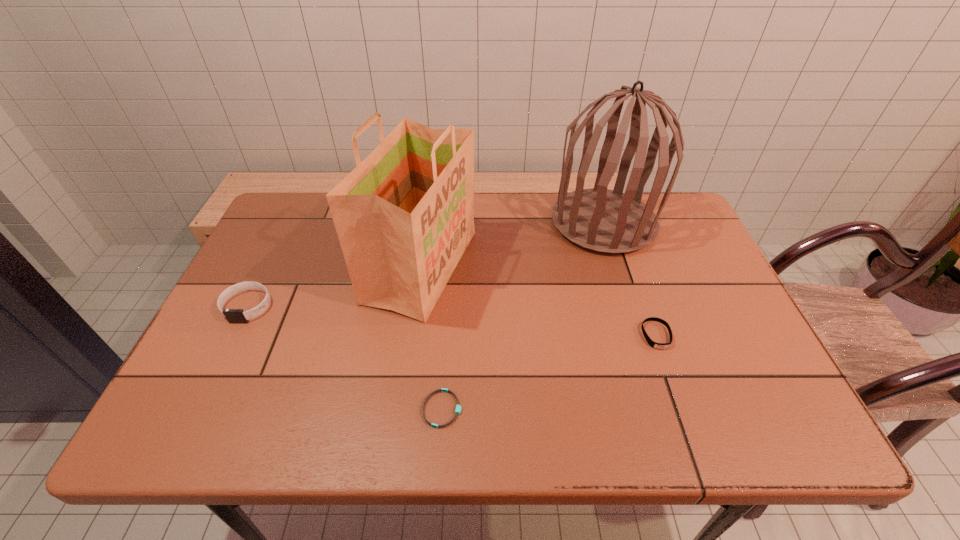
The image size is (960, 540). I want to click on free space between the leftmost object and the nearest wristband, so click(345, 357).

I want to click on vacant space that is in between the grocery bag and the shortest wristband, so click(x=432, y=338).

Where is `free space between the second shortest object and the third shortest object`? The width and height of the screenshot is (960, 540). free space between the second shortest object and the third shortest object is located at coordinates (452, 321).

Locate an element on the screen. This screenshot has width=960, height=540. object that stands as the fourth closest to the third shortest object is located at coordinates (653, 344).

Locate an element on the screen. The image size is (960, 540). object that is the closest to the rightmost wristband is located at coordinates tap(608, 221).

Identify the location of wristband that is the closest to the rightmost wristband. (458, 407).

At what (x,y) coordinates should I click in order to perform the action: click on wristband that is the closest one to the nearest wristband. Please return your answer as a coordinate pair (x, y). The image size is (960, 540). Looking at the image, I should click on (653, 344).

Identify the location of vacant space that satisfies the following two spatial constraints: 1. on the back side of the birdcage; 2. on the right side of the grocery bag. (427, 222).